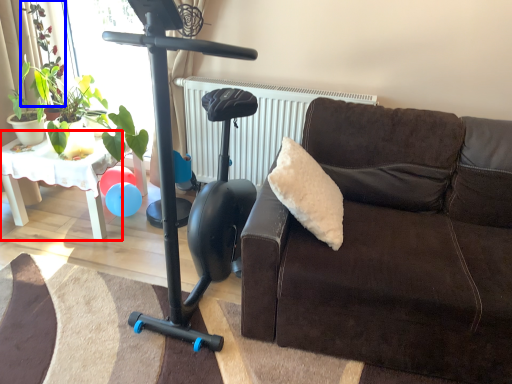
Question: Which object appears closest to the camera in this image, table (highlighted by a red box) or plant (highlighted by a blue box)?

Choices:
 (A) table
 (B) plant

Answer: (A)